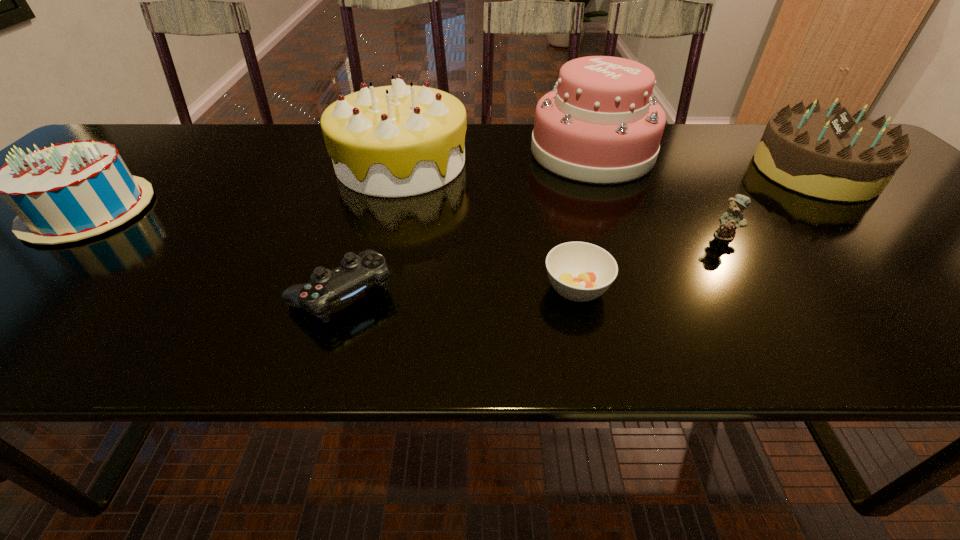
This screenshot has height=540, width=960. I want to click on birthday cake that is the second closest to the rightmost birthday cake, so click(66, 192).

Identify the location of birthday cake that is the second closest one to the second birthday cake from right to left. (831, 154).

You are a GUI agent. You are given a task and a screenshot of the screen. Output one action in this format:
    pyautogui.click(x=<x>, y=<y>)
    Task: Click on the vacant region that satisfies the following two spatial constraints: 1. on the front-facing side of the rightmost object; 2. on the front side of the second shortest object
    
    Given the screenshot: What is the action you would take?
    pyautogui.click(x=944, y=293)

The height and width of the screenshot is (540, 960). Identify the location of vacant region that satisfies the following two spatial constraints: 1. on the front-facing side of the rightmost birthday cake; 2. on the front side of the second shortest object. (944, 293).